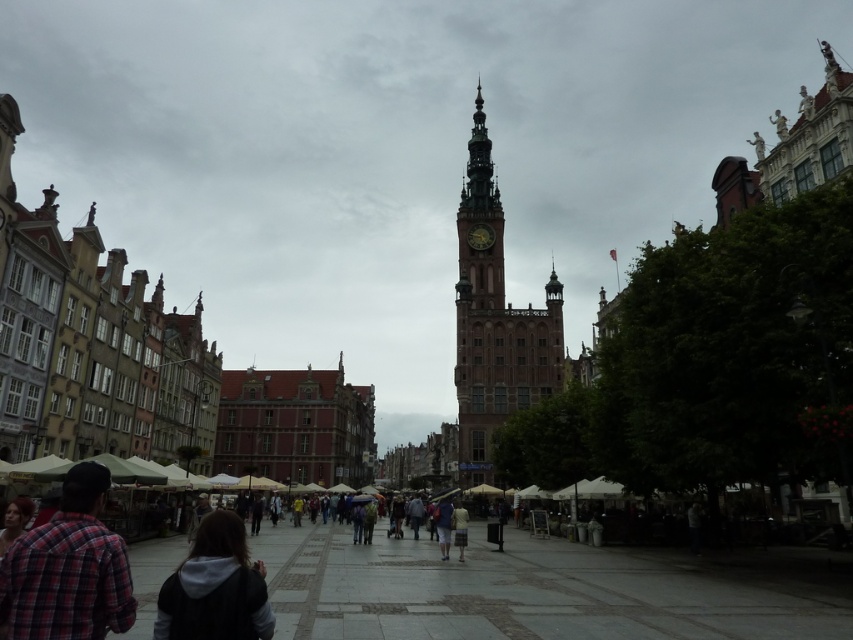
You are standing in the square and want to walk from point A to point B. Point A is at coordinates point (512, 381) and point B is at point (91, 509). Which direction should you head to reach point B from point A?

To reach point B from point A, you should head downward because point B is located below point A in the image.